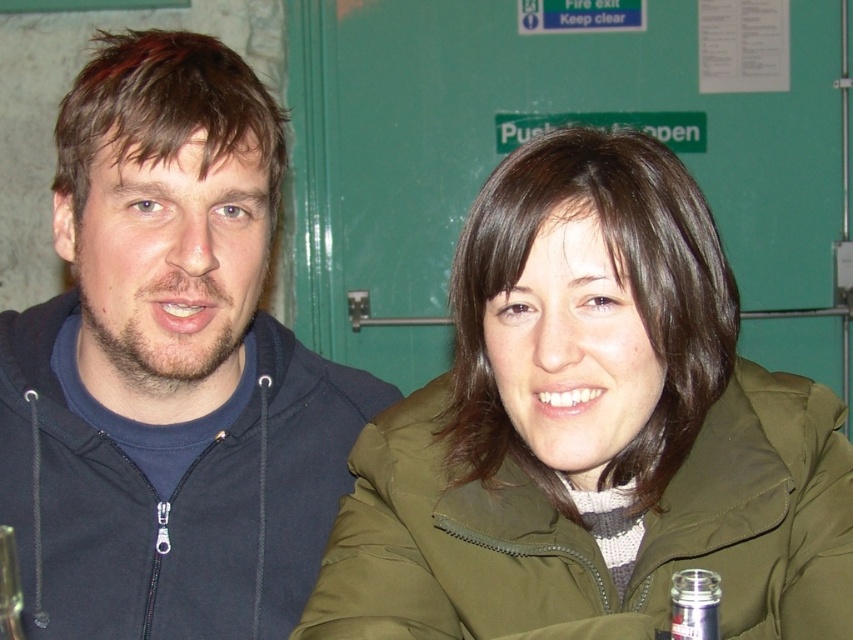
From the picture: Between olive-green jacket at center and clear glass bottle at center, which one is positioned lower?

clear glass bottle at center

Locate an element on the screen. The width and height of the screenshot is (853, 640). olive-green jacket at center is located at coordinates pos(592,428).

From the picture: Can you confirm if olive-green jacket at center is shorter than dark blue hoodie at left?

Yes.

Is olive-green jacket at center positioned at the back of dark blue hoodie at left?

That is False.

This screenshot has height=640, width=853. What do you see at coordinates (592, 428) in the screenshot?
I see `olive-green jacket at center` at bounding box center [592, 428].

Where is `olive-green jacket at center`? Image resolution: width=853 pixels, height=640 pixels. olive-green jacket at center is located at coordinates coord(592,428).

Between olive-green jacket at center and clear plastic bottle at lower left, which one has more height?

With more height is olive-green jacket at center.

Can you confirm if olive-green jacket at center is positioned to the left of clear plastic bottle at lower left?

Incorrect, olive-green jacket at center is not on the left side of clear plastic bottle at lower left.

Who is more forward, (474,568) or (0,600)?

Point (0,600)

Where is `olive-green jacket at center`? The height and width of the screenshot is (640, 853). olive-green jacket at center is located at coordinates (592, 428).